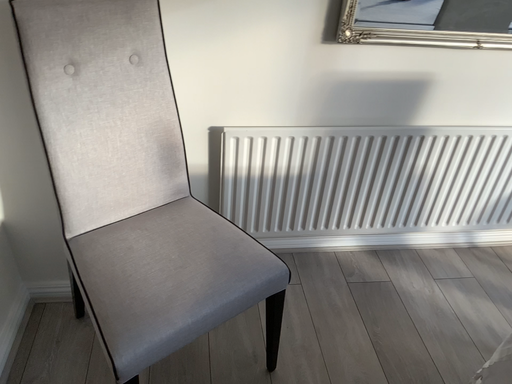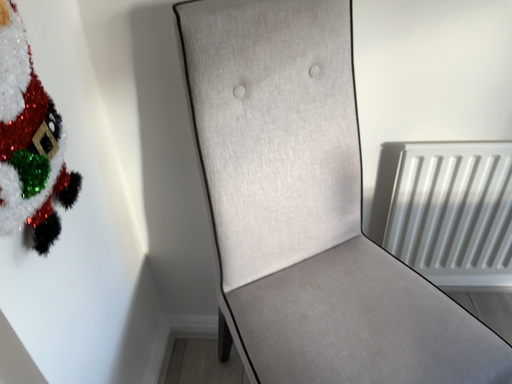
Question: Which way did the camera rotate in the video?

Choices:
 (A) rotated right
 (B) rotated left

Answer: (B)